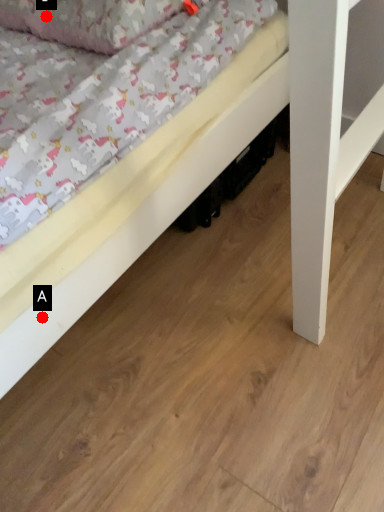
Question: Two points are circled on the image, labeled by A and B beside each circle. Which of the following is the closest to the observer?

Choices:
 (A) A is closer
 (B) B is closer

Answer: (A)